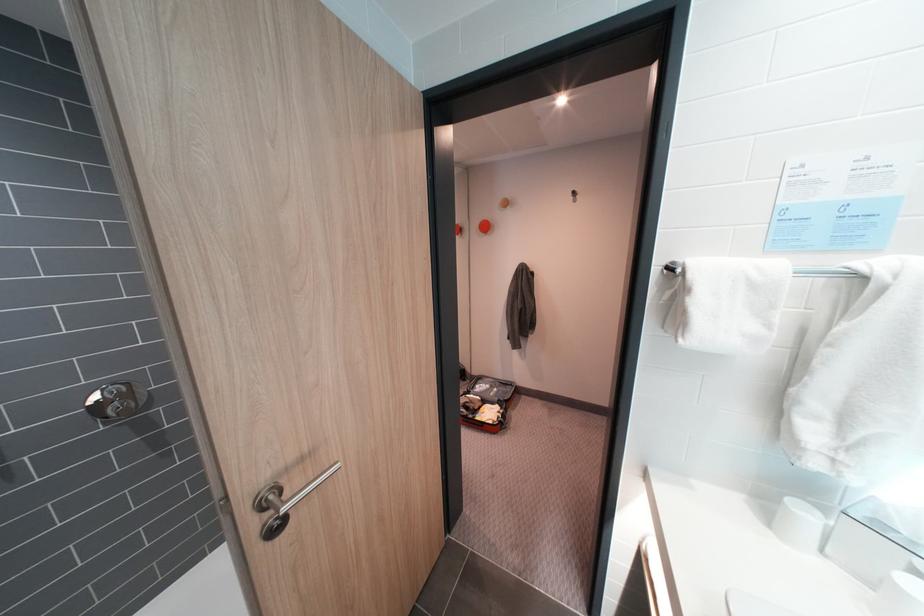
Image resolution: width=924 pixels, height=616 pixels. What do you see at coordinates (282, 516) in the screenshot?
I see `a silver door handle` at bounding box center [282, 516].